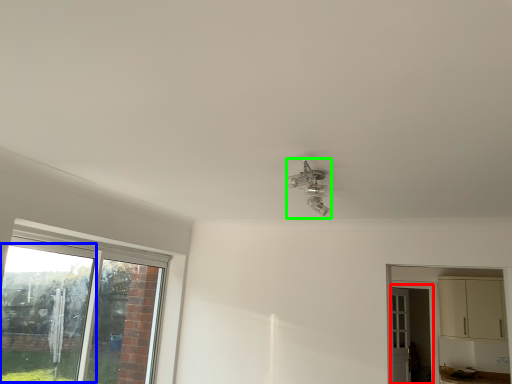
Question: Estimate the real-world distances between objects in this image. Which object is farther from screen door (highlighted by a red box), window screen (highlighted by a blue box) or light fixture (highlighted by a green box)?

Choices:
 (A) window screen
 (B) light fixture

Answer: (A)